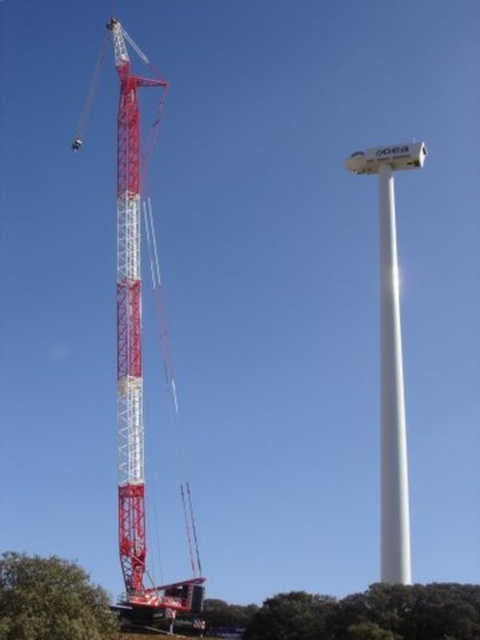
You are a bird looking for a place to perch. You can choose between the green leafy tree at lower center and the white smooth pole at right. Which one is shorter and better for a small bird like you?

The green leafy tree at lower center is not as tall as the white smooth pole at right, so it is shorter and better for a small bird like you.

You are standing at the center of the image. Which object is higher up in the scene, the white smooth pole at right or the green leafy tree at lower left?

The white smooth pole at right is located above the green leafy tree at lower left, so the white smooth pole at right is higher up in the scene.